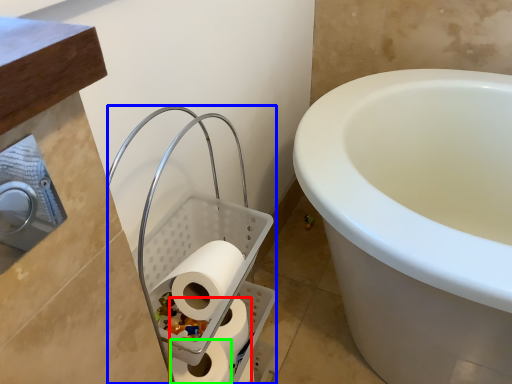
Question: Estimate the real-world distances between objects in this image. Which object is farther from toilet paper (highlighted by a red box), laundry basket (highlighted by a blue box) or toilet paper (highlighted by a green box)?

Choices:
 (A) laundry basket
 (B) toilet paper

Answer: (A)